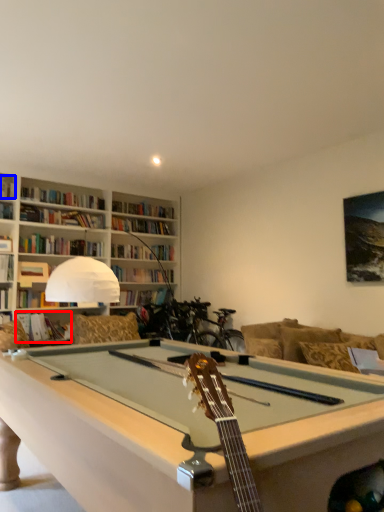
Question: Among these objects, which one is nearest to the camera, book (highlighted by a red box) or book (highlighted by a blue box)?

Choices:
 (A) book
 (B) book

Answer: (A)